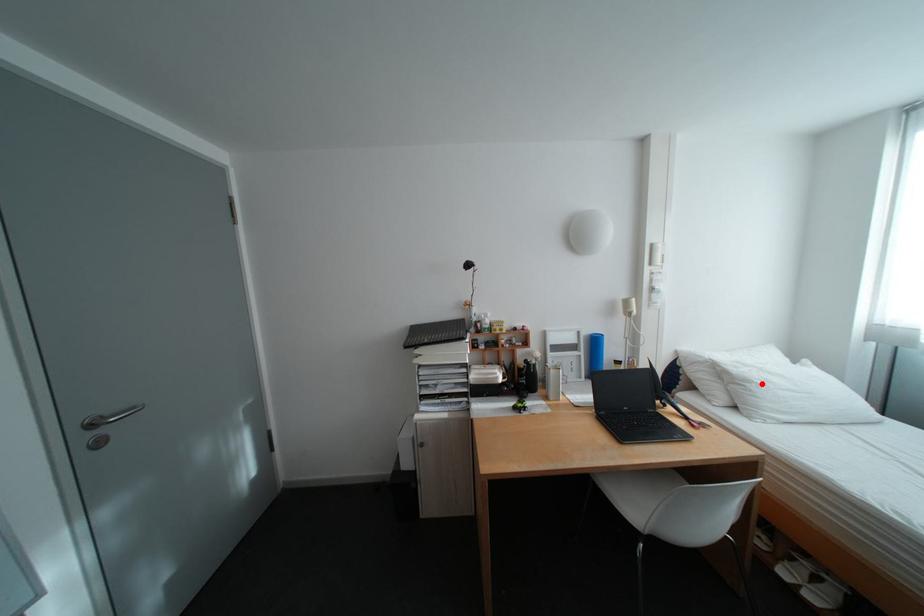
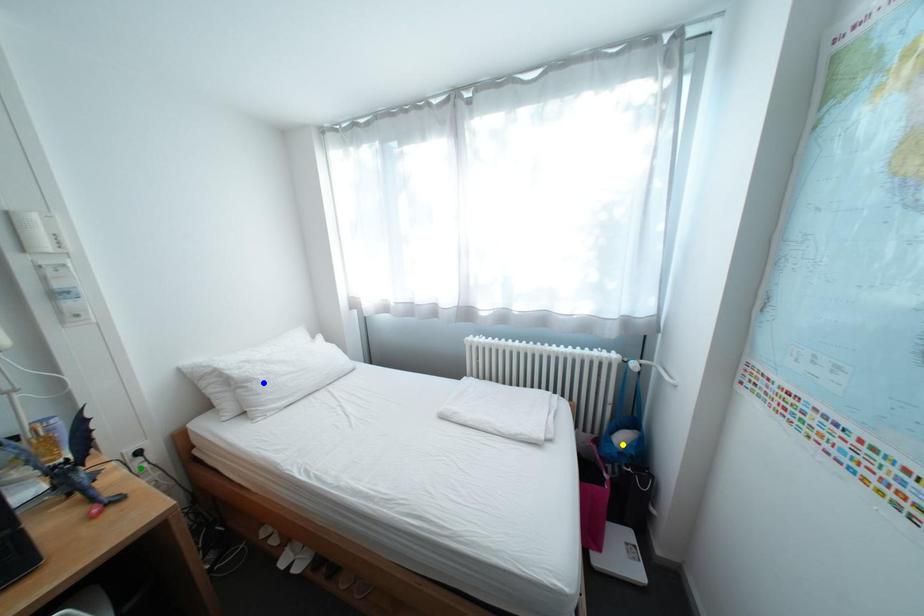
Question: I am providing you with two images of the same scene from different viewpoints. A red point is marked on the first image. You are given multiple points on the second image. In image 2, which mark is for the same physical point as the one in image 1?

Choices:
 (A) green point
 (B) yellow point
 (C) blue point

Answer: (C)